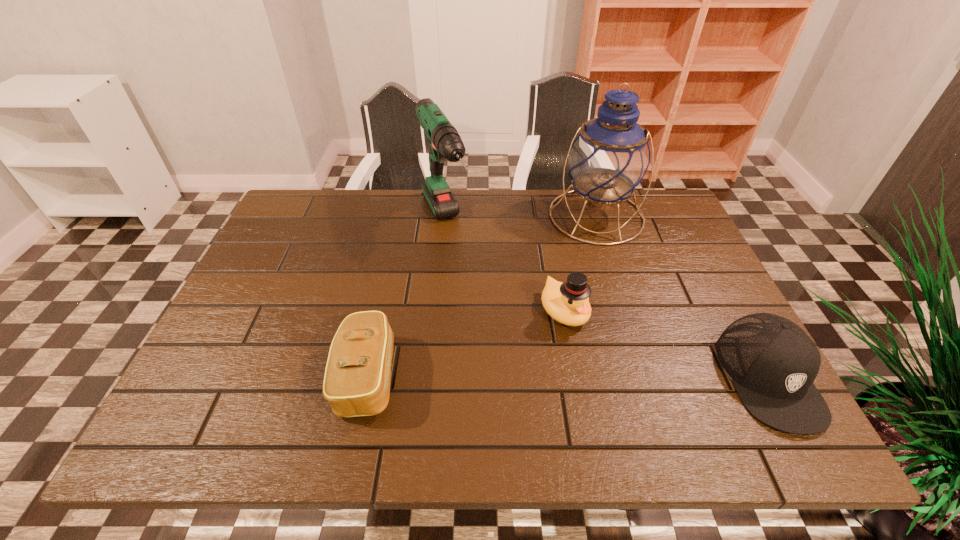
What are the coordinates of `object that is the second closest to the clutch bag` in the screenshot? It's located at (567, 302).